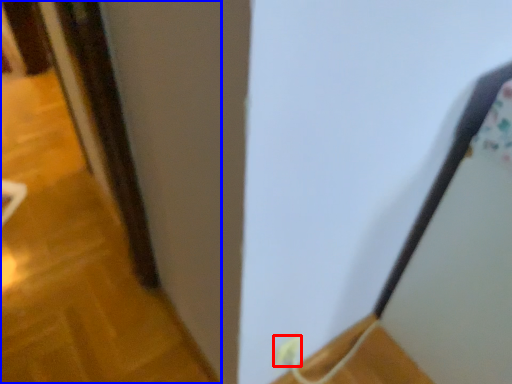
Question: Which of the following is the farthest to the observer, electric outlet (highlighted by a red box) or door (highlighted by a blue box)?

Choices:
 (A) electric outlet
 (B) door

Answer: (B)